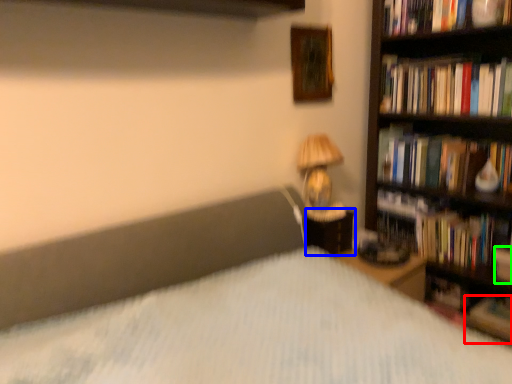
Question: Based on their relative distances, which object is farther from book (highlighted by a red box)? Choose from nightstand (highlighted by a blue box) and paperback book (highlighted by a green box).

Choices:
 (A) nightstand
 (B) paperback book

Answer: (A)